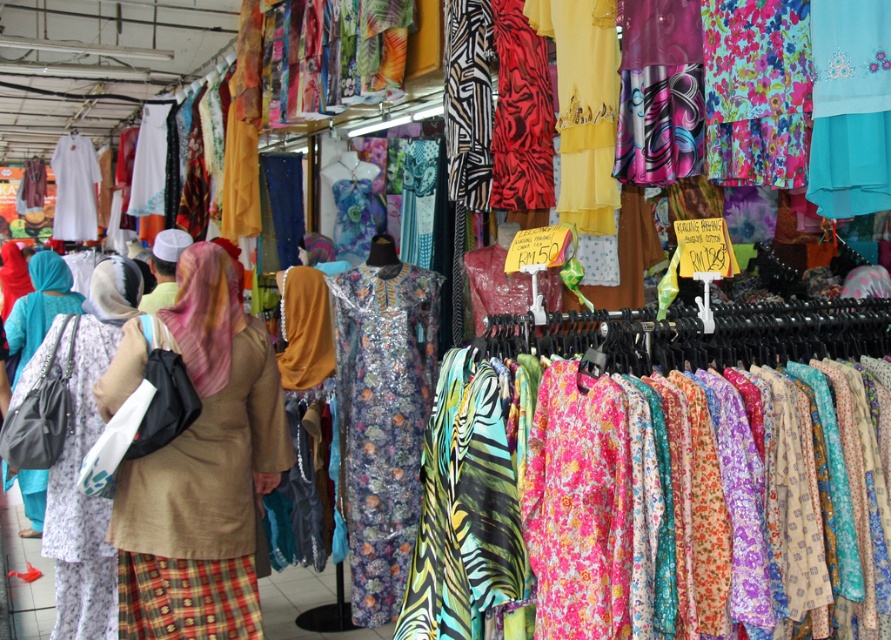
Question: Which object is farther from the camera taking this photo?

Choices:
 (A) printed fabric dress at center
 (B) beige fabric hijab at center
 (C) floral cotton dress at center

Answer: (C)

Question: Does beige fabric hijab at center have a greater width compared to white matte dress at left?

Choices:
 (A) yes
 (B) no

Answer: (B)

Question: Based on their relative distances, which object is farther from the printed fabric dress at center?

Choices:
 (A) white matte dress at left
 (B) floral-patterned dress at left
 (C) floral cotton dress at center

Answer: (A)

Question: Can you confirm if shiny floral dress at center is smaller than floral-patterned dress at left?

Choices:
 (A) yes
 (B) no

Answer: (A)

Question: Is printed fabric dress at center behind beige fabric hijab at center?

Choices:
 (A) yes
 (B) no

Answer: (B)

Question: Which object appears closest to the camera in this image?

Choices:
 (A) shiny floral dress at center
 (B) beige fabric hijab at center
 (C) white matte dress at left

Answer: (B)